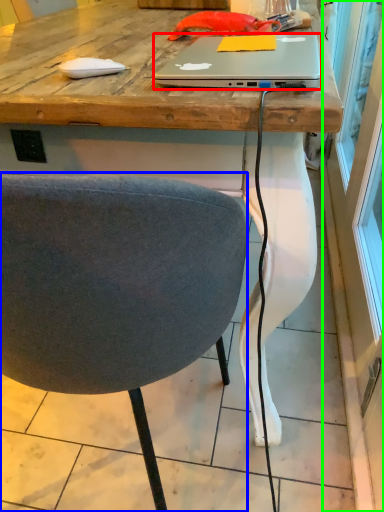
Question: Considering the real-world distances, which object is farthest from laptop (highlighted by a red box)? chair (highlighted by a blue box) or screen door (highlighted by a green box)?

Choices:
 (A) chair
 (B) screen door

Answer: (B)